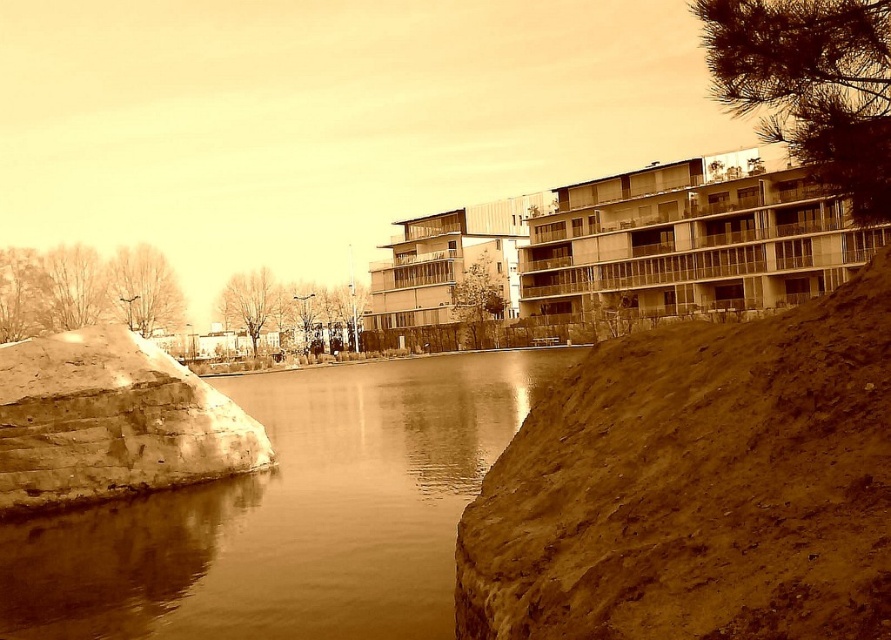
Which of these two, brown smooth water at center or matte concrete building at center, stands taller?

matte concrete building at center

Between brown smooth water at center and matte concrete building at center, which one is positioned higher?

matte concrete building at center is higher up.

Does point (333, 470) lie behind point (456, 291)?

No, (333, 470) is in front of (456, 291).

Identify the location of brown smooth water at center. The width and height of the screenshot is (891, 640). (290, 515).

Consider the image. Can you confirm if brown dirt embankment at right is wider than brown smooth water at center?

No, brown dirt embankment at right is not wider than brown smooth water at center.

Does brown dirt embankment at right appear under brown smooth water at center?

Actually, brown dirt embankment at right is above brown smooth water at center.

Is point (736, 488) behind point (324, 541)?

No, (736, 488) is closer to viewer.

Locate an element on the screen. This screenshot has width=891, height=640. brown dirt embankment at right is located at coordinates (697, 484).

Does brown smooth water at center appear on the left side of rustic stone wall at left?

In fact, brown smooth water at center is to the right of rustic stone wall at left.

Measure the distance between point (399, 440) and camera.

A distance of 26.04 meters exists between point (399, 440) and camera.

Identify the location of brown smooth water at center. The image size is (891, 640). (290, 515).